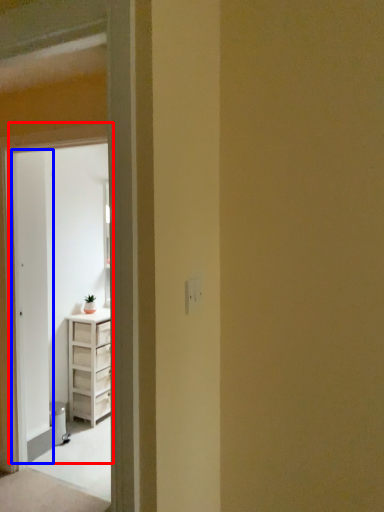
Question: Which point is further to the camera, door (highlighted by a red box) or screen door (highlighted by a blue box)?

Choices:
 (A) door
 (B) screen door

Answer: (B)